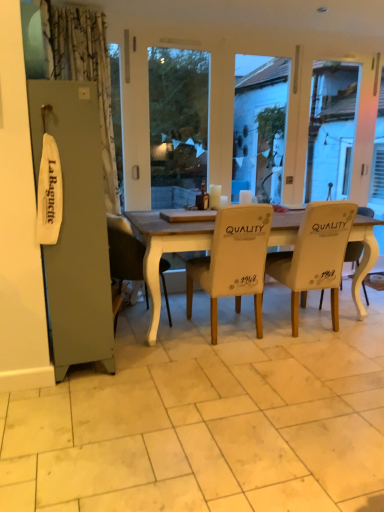
I want to click on free location in front of white fabric chair at center, placed as the 3th chair when sorted from left to right, so click(316, 356).